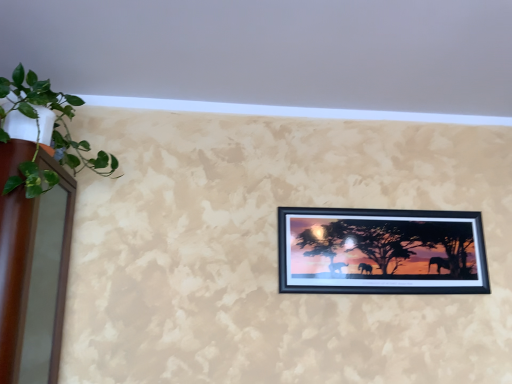
Question: Is black matte picture frame at center to the right of beige textured wall at upper center from the viewer's perspective?

Choices:
 (A) yes
 (B) no

Answer: (A)

Question: Is black matte picture frame at center to the left of beige textured wall at upper center from the viewer's perspective?

Choices:
 (A) yes
 (B) no

Answer: (B)

Question: Is black matte picture frame at center next to beige textured wall at upper center and touching it?

Choices:
 (A) no
 (B) yes

Answer: (A)

Question: Considering the relative sizes of black matte picture frame at center and beige textured wall at upper center in the image provided, is black matte picture frame at center taller than beige textured wall at upper center?

Choices:
 (A) yes
 (B) no

Answer: (A)

Question: Considering the relative sizes of black matte picture frame at center and beige textured wall at upper center in the image provided, is black matte picture frame at center shorter than beige textured wall at upper center?

Choices:
 (A) no
 (B) yes

Answer: (A)

Question: Does black matte picture frame at center have a smaller size compared to beige textured wall at upper center?

Choices:
 (A) yes
 (B) no

Answer: (A)

Question: Is green leafy plant at left not inside beige textured wall at upper center?

Choices:
 (A) no
 (B) yes

Answer: (B)

Question: From a real-world perspective, does green leafy plant at left sit lower than beige textured wall at upper center?

Choices:
 (A) yes
 (B) no

Answer: (A)

Question: Is the position of green leafy plant at left more distant than that of beige textured wall at upper center?

Choices:
 (A) yes
 (B) no

Answer: (A)

Question: Is green leafy plant at left turned away from beige textured wall at upper center?

Choices:
 (A) yes
 (B) no

Answer: (B)

Question: From a real-world perspective, does green leafy plant at left stand above beige textured wall at upper center?

Choices:
 (A) no
 (B) yes

Answer: (A)

Question: Is green leafy plant at left aimed at beige textured wall at upper center?

Choices:
 (A) no
 (B) yes

Answer: (B)

Question: From a real-world perspective, is beige textured wall at upper center physically below green leafy plant at left?

Choices:
 (A) no
 (B) yes

Answer: (A)